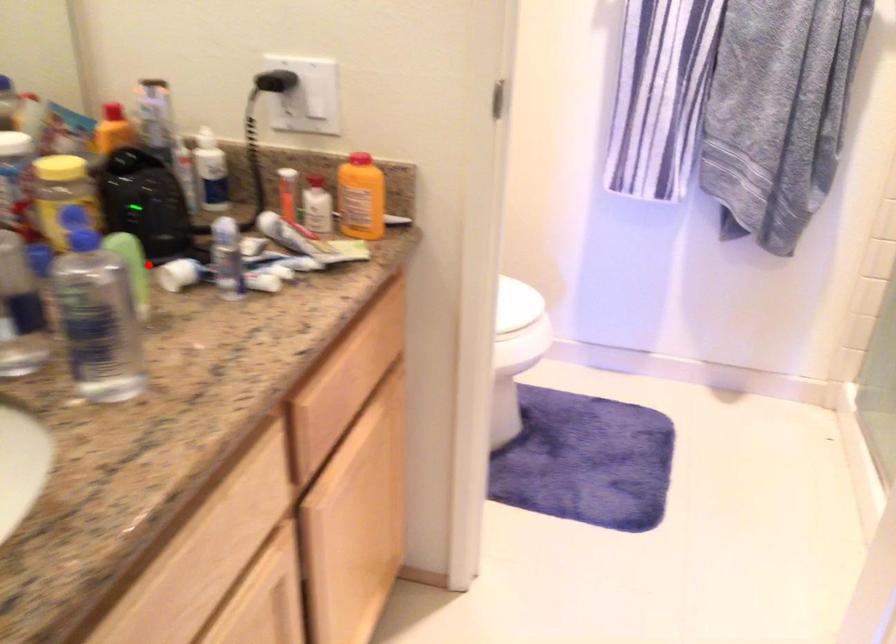
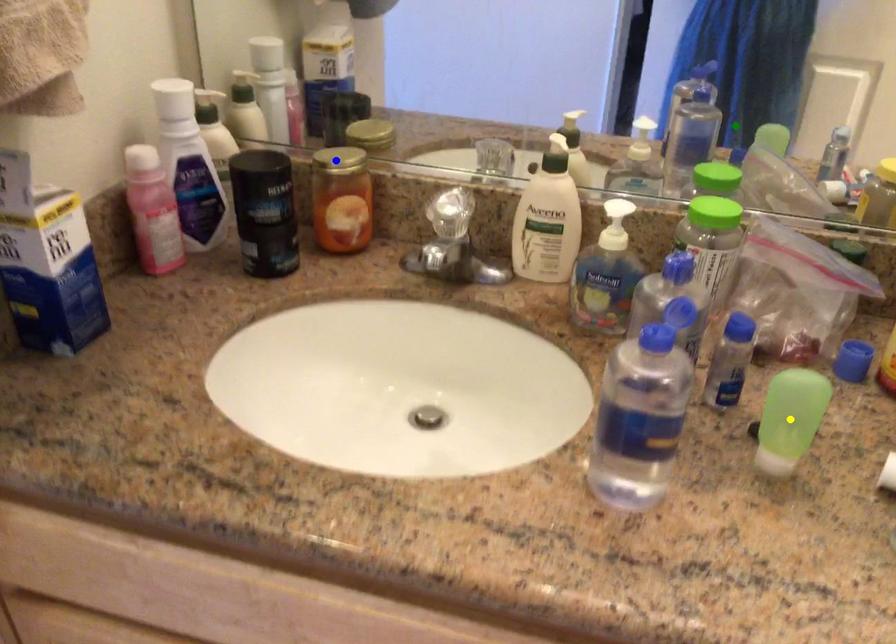
Question: I am providing you with two images of the same scene from different viewpoints. A red point is marked on the first image. You are given multiple points on the second image. Which spot in image 2 lines up with the point in image 1?

Choices:
 (A) blue point
 (B) yellow point
 (C) green point

Answer: (B)